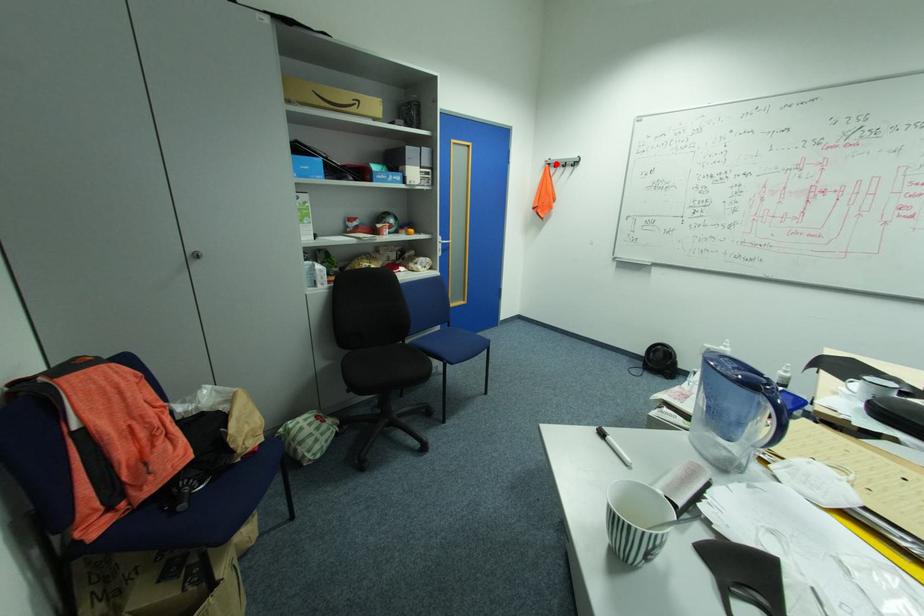
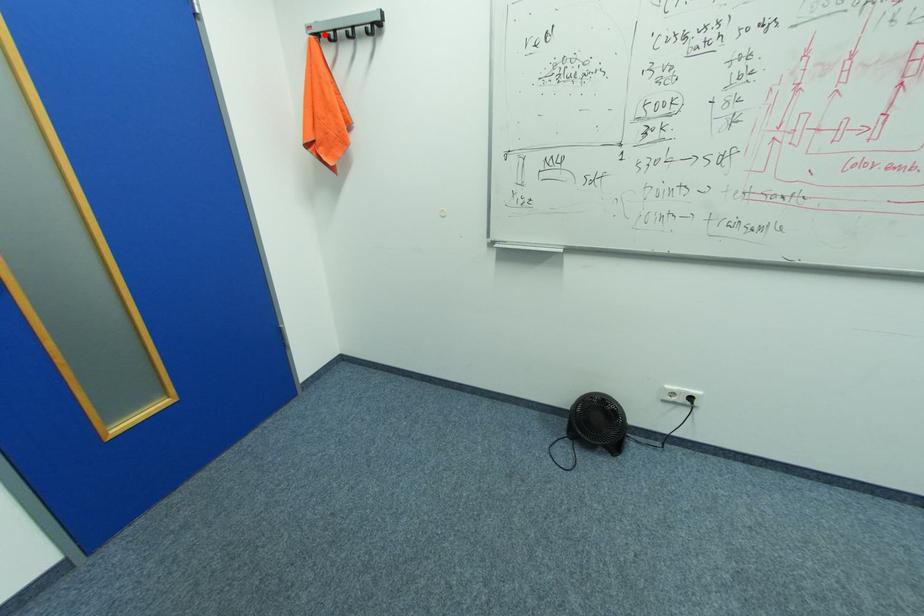
I am providing you with two images of the same scene from different viewpoints. A red point is marked on the first image and another point is marked on the second image. Is the marked point in image1 the same physical position as the marked point in image2?

Yes